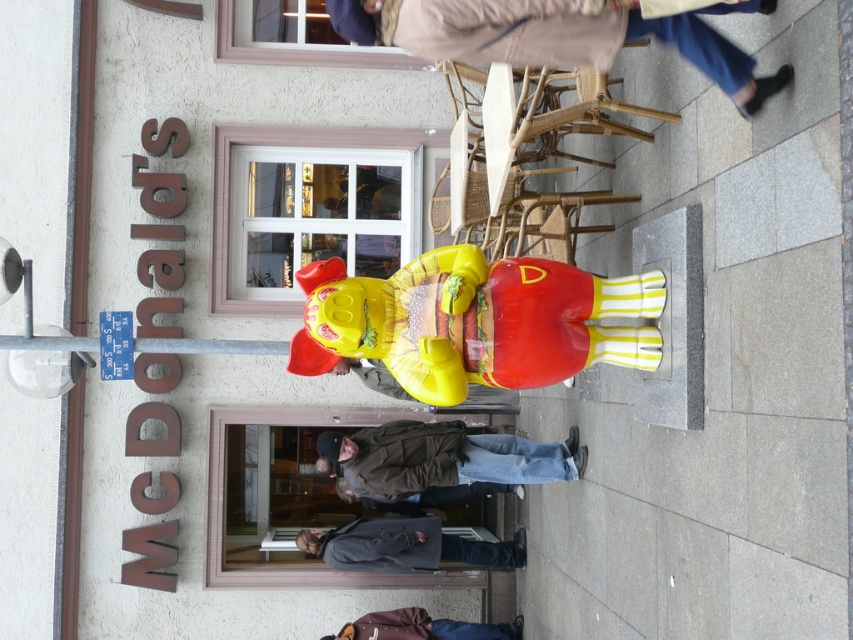
Question: Which point is closer to the camera?

Choices:
 (A) (315, 532)
 (B) (366, 44)
 (C) (323, 408)

Answer: (B)

Question: Can you confirm if brown leather jacket at lower center is bigger than transparent glass window at upper center?

Choices:
 (A) yes
 (B) no

Answer: (A)

Question: Among these points, which one is farthest from the camera?

Choices:
 (A) (224, 412)
 (B) (256, 26)

Answer: (B)

Question: Is glossy plastic bear at center thinner than wooden stool at center?

Choices:
 (A) yes
 (B) no

Answer: (B)

Question: Which object is positioned farthest from the transparent glass door at center?

Choices:
 (A) transparent glass window at upper center
 (B) dark gray fabric jacket at lower center
 (C) white plastic window at center

Answer: (A)

Question: Does transparent glass door at center have a smaller size compared to white plastic window at center?

Choices:
 (A) yes
 (B) no

Answer: (B)